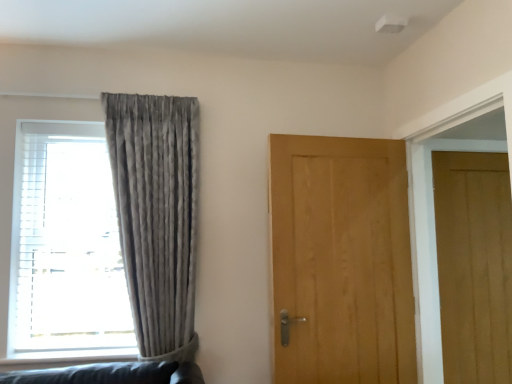
The image size is (512, 384). Describe the element at coordinates (342, 260) in the screenshot. I see `light brown wood door at center, acting as the 2th door starting from the back` at that location.

The image size is (512, 384). I want to click on satin grey curtain at left, so [x=157, y=215].

What's the angular difference between matte gray curtain at left and satin grey curtain at left's facing directions?

They differ by 3.9e-05 degrees in their facing directions.

Between matte gray curtain at left and satin grey curtain at left, which one is positioned behind?

matte gray curtain at left is behind.

Based on the photo, from a real-world perspective, does matte gray curtain at left stand above satin grey curtain at left?

Yes, from a real-world perspective, matte gray curtain at left is above satin grey curtain at left.

Identify the location of curtain located on the right of matte gray curtain at left. Image resolution: width=512 pixels, height=384 pixels. (157, 215).

How many degrees apart are the facing directions of satin grey curtain at left and matte gray curtain at left?

3.9e-05 degrees.

Is satin grey curtain at left positioned with its back to matte gray curtain at left?

Yes, satin grey curtain at left's orientation is away from matte gray curtain at left.

Is satin grey curtain at left far away from matte gray curtain at left?

No, satin grey curtain at left is not far away from matte gray curtain at left.

Is matte gray curtain at left oriented away from light brown wood door at center, placed as the 1th door when sorted from left to right?

No, matte gray curtain at left's orientation is not away from light brown wood door at center, placed as the 1th door when sorted from left to right.

How much distance is there between matte gray curtain at left and light brown wood door at center, positioned as the 1th door in front-to-back order?

matte gray curtain at left and light brown wood door at center, positioned as the 1th door in front-to-back order, are 4.06 feet apart from each other.

Looking at this image, from the image's perspective, is matte gray curtain at left below light brown wood door at center, placed as the 1th door when sorted from left to right?

No, from the image's perspective, matte gray curtain at left is not below light brown wood door at center, placed as the 1th door when sorted from left to right.

Does matte gray curtain at left have a greater width compared to light brown wood door at center, acting as the 2th door starting from the back?

Indeed, matte gray curtain at left has a greater width compared to light brown wood door at center, acting as the 2th door starting from the back.

Considering the relative sizes of satin grey curtain at left and light brown wood door at right, acting as the first door starting from the back, in the image provided, is satin grey curtain at left smaller than light brown wood door at right, acting as the first door starting from the back,?

No.

Does point (128, 255) come behind point (457, 300)?

No, it is not.

From the image's perspective, which one is positioned lower, satin grey curtain at left or light brown wood door at right, marked as the 1th door in a right-to-left arrangement?

light brown wood door at right, marked as the 1th door in a right-to-left arrangement.

Which is more to the left, light brown wood door at right, acting as the first door starting from the back, or light brown wood door at center, placed as the 1th door when sorted from left to right?

light brown wood door at center, placed as the 1th door when sorted from left to right, is more to the left.

Based on the photo, is light brown wood door at right, marked as the 1th door in a right-to-left arrangement, not within light brown wood door at center, positioned as the 1th door in front-to-back order?

Yes, light brown wood door at right, marked as the 1th door in a right-to-left arrangement, is located beyond the bounds of light brown wood door at center, positioned as the 1th door in front-to-back order.

From a real-world perspective, which object stands above the other?

light brown wood door at center, acting as the 2th door starting from the back, from a real-world perspective.

Is light brown wood door at right, acting as the first door starting from the back, not near light brown wood door at center, positioned as the 1th door in front-to-back order?

No, light brown wood door at right, acting as the first door starting from the back, is not far away from light brown wood door at center, positioned as the 1th door in front-to-back order.

From the image's perspective, which is below, satin grey curtain at left or light brown wood door at center, positioned as the 1th door in front-to-back order?

light brown wood door at center, positioned as the 1th door in front-to-back order.

Based on the photo, measure the distance between satin grey curtain at left and light brown wood door at center, which is the second door from right to left.

satin grey curtain at left and light brown wood door at center, which is the second door from right to left, are 29.83 inches apart from each other.

Which of these two, satin grey curtain at left or light brown wood door at center, placed as the 1th door when sorted from left to right, stands shorter?

Standing shorter between the two is light brown wood door at center, placed as the 1th door when sorted from left to right.

In terms of width, does satin grey curtain at left look wider or thinner when compared to light brown wood door at center, acting as the 2th door starting from the back?

satin grey curtain at left is wider than light brown wood door at center, acting as the 2th door starting from the back.

Is light brown wood door at right, marked as the 1th door in a right-to-left arrangement, not close to matte gray curtain at left?

Indeed, light brown wood door at right, marked as the 1th door in a right-to-left arrangement, is not near matte gray curtain at left.

Looking at the image, does light brown wood door at right, the second door positioned from the front, seem bigger or smaller compared to matte gray curtain at left?

Considering their sizes, light brown wood door at right, the second door positioned from the front, takes up less space than matte gray curtain at left.

Is light brown wood door at right, marked as the 1th door in a right-to-left arrangement, turned away from matte gray curtain at left?

No.

Does point (467, 234) lie behind point (73, 220)?

Yes.

Where is `window that appears behind the satin grey curtain at left`? This screenshot has height=384, width=512. window that appears behind the satin grey curtain at left is located at coordinates (66, 246).

At what (x,y) coordinates should I click in order to perform the action: click on curtain below the matte gray curtain at left (from a real-world perspective). Please return your answer as a coordinate pair (x, y). The width and height of the screenshot is (512, 384). Looking at the image, I should click on (157, 215).

Based on the photo, when comparing their distances from satin grey curtain at left, does light brown wood door at right, the second door positioned from the front, or matte gray curtain at left seem further?

light brown wood door at right, the second door positioned from the front.

From the image, which object appears to be farther from matte gray curtain at left, light brown wood door at right, marked as the 1th door in a right-to-left arrangement, or satin grey curtain at left?

The object further to matte gray curtain at left is light brown wood door at right, marked as the 1th door in a right-to-left arrangement.

From the image, which object appears to be farther from light brown wood door at center, acting as the 2th door starting from the back, matte gray curtain at left or light brown wood door at right, acting as the first door starting from the back?

matte gray curtain at left.

From the image, which object appears to be farther from light brown wood door at right, acting as the first door starting from the back, satin grey curtain at left or matte gray curtain at left?

matte gray curtain at left lies further to light brown wood door at right, acting as the first door starting from the back, than the other object.

From the picture: Considering their positions, is light brown wood door at center, which is the second door from right to left, positioned further to satin grey curtain at left than light brown wood door at right, acting as the first door starting from the back?

Based on the image, light brown wood door at right, acting as the first door starting from the back, appears to be further to satin grey curtain at left.

Looking at the image, which one is located closer to matte gray curtain at left, satin grey curtain at left or light brown wood door at right, marked as the 1th door in a right-to-left arrangement?

The object closer to matte gray curtain at left is satin grey curtain at left.

In the scene shown: Estimate the real-world distances between objects in this image. Which object is further from light brown wood door at center, acting as the 2th door starting from the back, light brown wood door at right, marked as the 1th door in a right-to-left arrangement, or satin grey curtain at left?

satin grey curtain at left is positioned further to the anchor light brown wood door at center, acting as the 2th door starting from the back.

Which object lies nearer to the anchor point satin grey curtain at left, light brown wood door at center, placed as the 1th door when sorted from left to right, or matte gray curtain at left?

matte gray curtain at left is closer to satin grey curtain at left.

This screenshot has height=384, width=512. Identify the location of door situated between matte gray curtain at left and light brown wood door at right, which is the second door in left-to-right order, from left to right. (342, 260).

Find the location of `curtain between matte gray curtain at left and light brown wood door at center, acting as the 2th door starting from the back`. curtain between matte gray curtain at left and light brown wood door at center, acting as the 2th door starting from the back is located at coordinates (157, 215).

Where is `door between satin grey curtain at left and light brown wood door at right, which is the second door in left-to-right order, in the horizontal direction`? Image resolution: width=512 pixels, height=384 pixels. door between satin grey curtain at left and light brown wood door at right, which is the second door in left-to-right order, in the horizontal direction is located at coordinates (342, 260).

Image resolution: width=512 pixels, height=384 pixels. Identify the location of curtain situated between matte gray curtain at left and light brown wood door at right, acting as the first door starting from the back, from left to right. (157, 215).